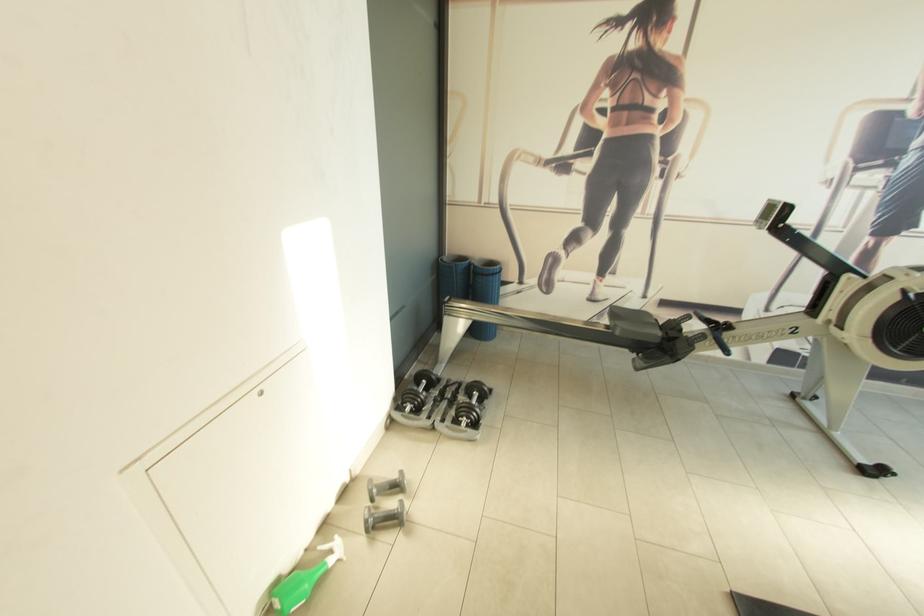
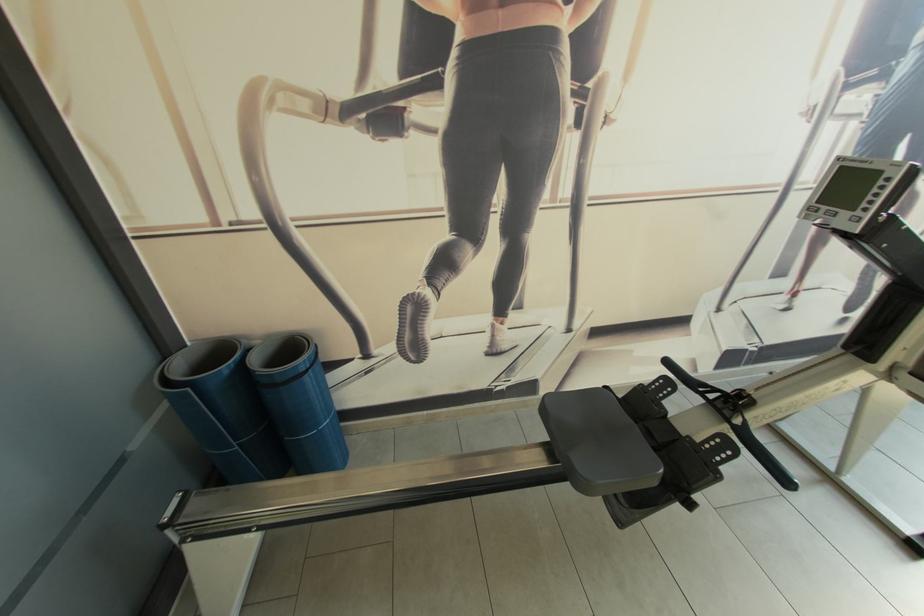
From the picture: What movement of the cameraman would produce the second image?

The cameraman moved toward right, forward.